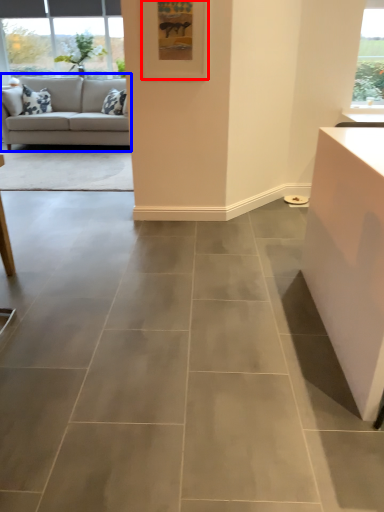
Question: Which object appears closest to the camera in this image, picture frame (highlighted by a red box) or studio couch (highlighted by a blue box)?

Choices:
 (A) picture frame
 (B) studio couch

Answer: (A)